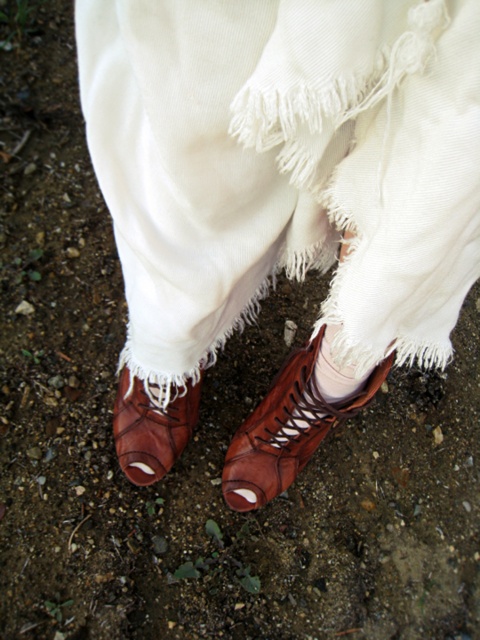
Question: Which is nearer to the leather boot at lower center?

Choices:
 (A) brown leather boot at center
 (B) matte brown shoe at lower center

Answer: (A)

Question: Which object appears closest to the camera in this image?

Choices:
 (A) matte brown shoe at lower center
 (B) leather boot at lower center
 (C) brown leather boot at center

Answer: (B)

Question: Does brown leather boot at center lie behind matte brown shoe at lower center?

Choices:
 (A) yes
 (B) no

Answer: (B)

Question: Is leather boot at lower center thinner than brown leather boot at center?

Choices:
 (A) no
 (B) yes

Answer: (A)

Question: Observing the image, what is the correct spatial positioning of brown leather boot at center in reference to matte brown shoe at lower center?

Choices:
 (A) below
 (B) above

Answer: (B)

Question: Which point appears farthest from the camera in this image?

Choices:
 (A) (365, 392)
 (B) (136, 472)
 (C) (295, 388)

Answer: (B)